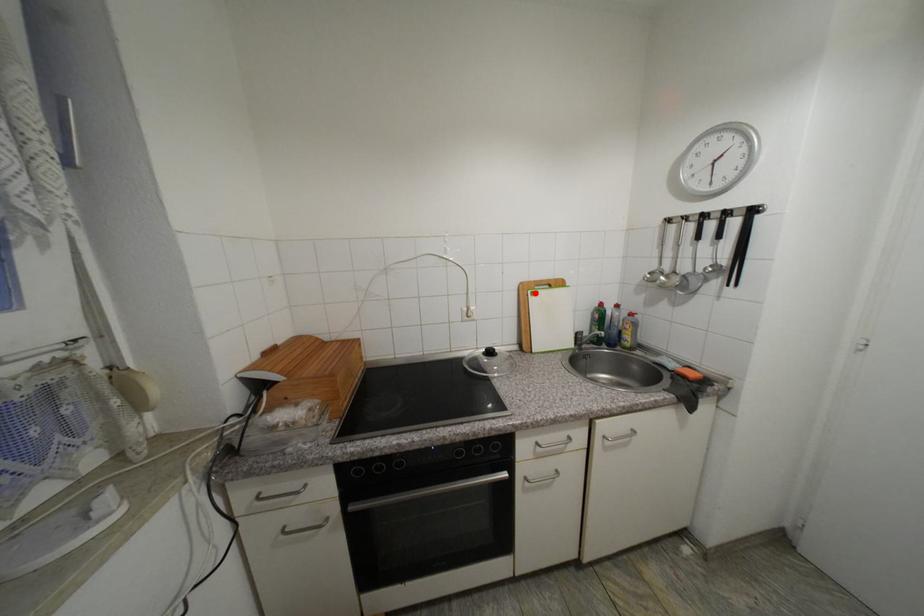
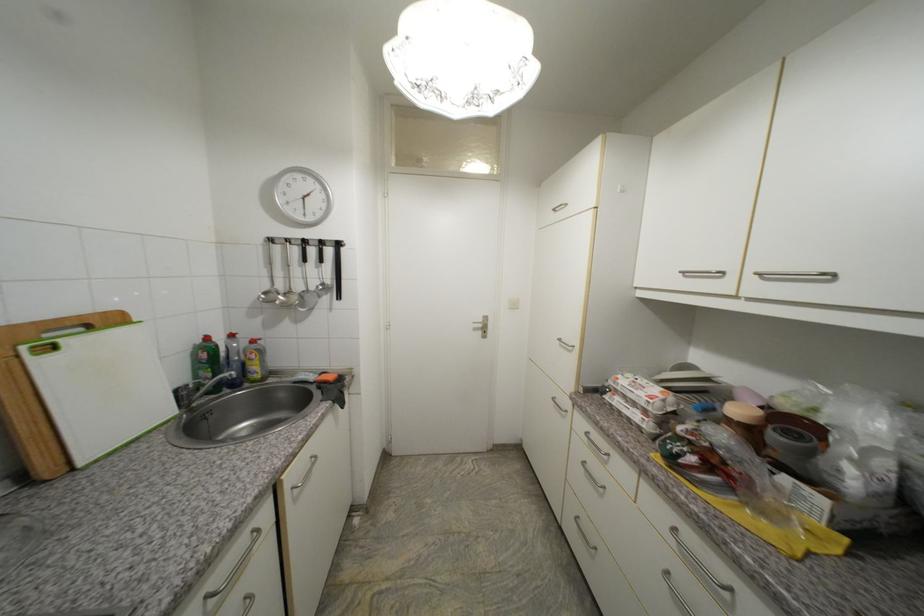
Locate, in the second image, the point that corresponds to the highlighted location in the first image.

(30, 349)